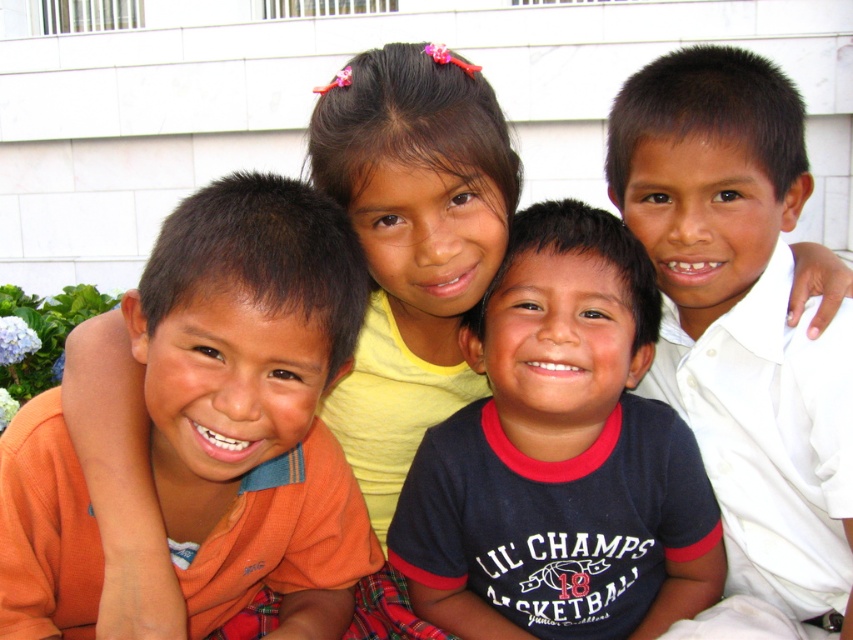
Is orange cotton shirt at left above dark blue jersey at center?

Indeed, orange cotton shirt at left is positioned over dark blue jersey at center.

Who is shorter, orange cotton shirt at left or dark blue jersey at center?

Standing shorter between the two is orange cotton shirt at left.

I want to click on orange cotton shirt at left, so click(253, 397).

Image resolution: width=853 pixels, height=640 pixels. I want to click on orange cotton shirt at left, so click(253, 397).

Which is below, orange cotton shirt at left or white smooth shirt at right?

orange cotton shirt at left is lower down.

Can you confirm if orange cotton shirt at left is shorter than white smooth shirt at right?

Yes.

Identify the location of orange cotton shirt at left. This screenshot has width=853, height=640. (253, 397).

Where is `orange cotton shirt at left`? orange cotton shirt at left is located at coordinates (253, 397).

Can you confirm if dark blue jersey at center is shorter than white smooth shirt at right?

Correct, dark blue jersey at center is not as tall as white smooth shirt at right.

Can you confirm if dark blue jersey at center is positioned above white smooth shirt at right?

Incorrect, dark blue jersey at center is not positioned above white smooth shirt at right.

Does point (585, 236) lie in front of point (833, 477)?

No, it is not.

You are a GUI agent. You are given a task and a screenshot of the screen. Output one action in this format:
    pyautogui.click(x=<x>, y=<y>)
    Task: Click on the dark blue jersey at center
    The width and height of the screenshot is (853, 640).
    Given the screenshot: What is the action you would take?
    pyautogui.click(x=560, y=456)